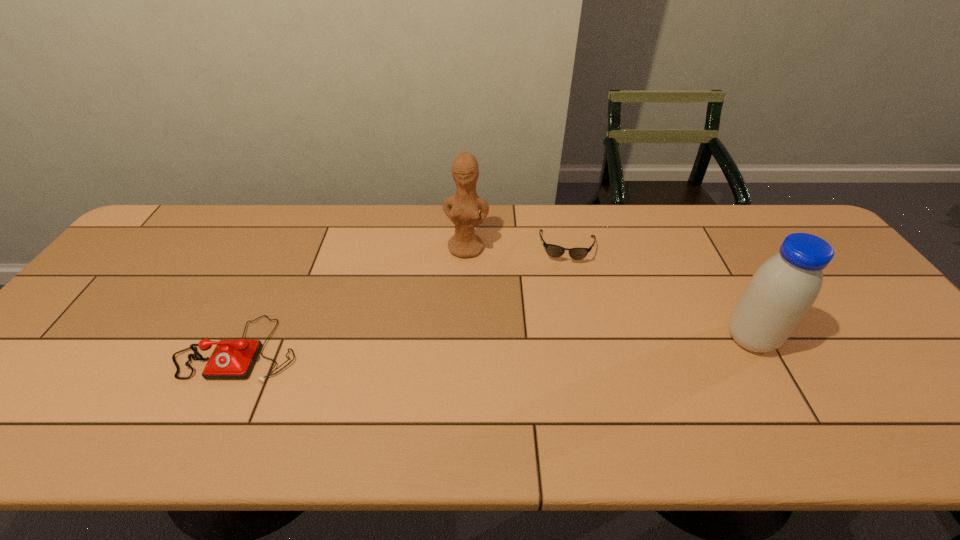
What are the coordinates of `free point located 0.270m on the front-facing side of the third object from right to left` in the screenshot? It's located at (450, 331).

At what (x,y) coordinates should I click in order to perform the action: click on vacant region located on the front-facing side of the third object from right to left. Please return your answer as a coordinate pair (x, y). The width and height of the screenshot is (960, 540). Looking at the image, I should click on (460, 281).

At what (x,y) coordinates should I click in order to perform the action: click on vacant space located 0.250m on the front-facing side of the third object from right to left. Please return your answer as a coordinate pair (x, y). Image resolution: width=960 pixels, height=540 pixels. Looking at the image, I should click on click(452, 325).

At what (x,y) coordinates should I click in order to perform the action: click on sunglasses located in the far edge section of the desktop. Please return your answer as a coordinate pair (x, y). Looking at the image, I should click on (552, 250).

At what (x,y) coordinates should I click in order to perform the action: click on figurine positioned at the far edge. Please return your answer as a coordinate pair (x, y). Image resolution: width=960 pixels, height=540 pixels. Looking at the image, I should click on (462, 209).

Where is `object that is at the near edge`? The image size is (960, 540). object that is at the near edge is located at coordinates (231, 359).

Identify the location of free space at the far edge of the desktop. (264, 219).

You are a GUI agent. You are given a task and a screenshot of the screen. Output one action in this format:
    pyautogui.click(x=<x>, y=<y>)
    Task: Click on the free space at the near edge of the desktop
    The image size is (960, 540).
    Given the screenshot: What is the action you would take?
    pyautogui.click(x=882, y=403)

Image resolution: width=960 pixels, height=540 pixels. In order to click on free region at the left edge of the desktop in this screenshot , I will do `click(97, 305)`.

Locate an element on the screen. Image resolution: width=960 pixels, height=540 pixels. free space at the right edge of the desktop is located at coordinates (867, 361).